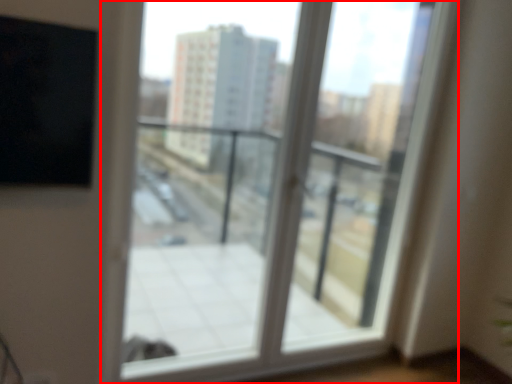
Question: From the image's perspective, what is the correct spatial relationship of window (annotated by the red box) in relation to screen door?

Choices:
 (A) above
 (B) below

Answer: (A)